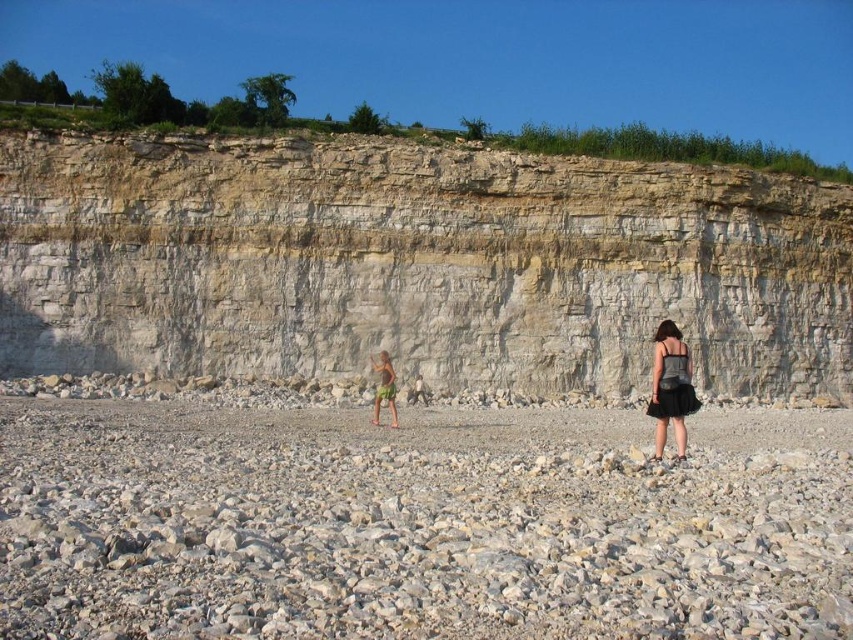
Question: Considering the real-world distances, which object is farthest from the gray gravel beach at center?

Choices:
 (A) white rock cliff at center
 (B) green fabric shorts at center

Answer: (A)

Question: Is gray gravel beach at center thinner than black tulle skirt at center?

Choices:
 (A) yes
 (B) no

Answer: (B)

Question: Can you confirm if white rock cliff at center is positioned below green fabric shorts at center?

Choices:
 (A) no
 (B) yes

Answer: (A)

Question: Estimate the real-world distances between objects in this image. Which object is closer to the white rock cliff at center?

Choices:
 (A) black tulle skirt at center
 (B) green fabric shorts at center

Answer: (B)

Question: Which is farther from the gray gravel beach at center?

Choices:
 (A) black tulle skirt at center
 (B) green fabric shorts at center

Answer: (B)

Question: Does gray gravel beach at center appear over black tulle skirt at center?

Choices:
 (A) yes
 (B) no

Answer: (B)